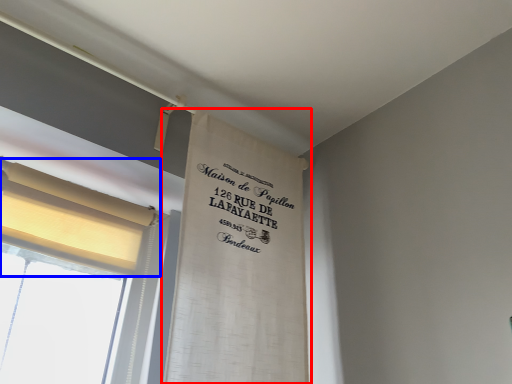
Question: Which object appears closest to the camera in this image, curtain (highlighted by a red box) or curtain (highlighted by a blue box)?

Choices:
 (A) curtain
 (B) curtain

Answer: (A)